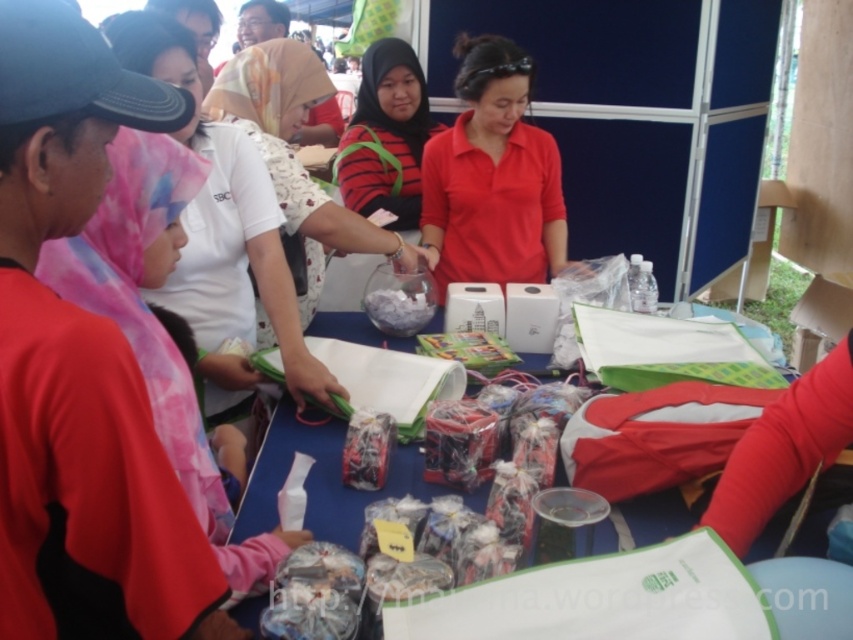
You are a participant at this event and you want to place a new item on the table. The item must be placed to the right of the pink fabric headscarf at left but not overlapping with the translucent glass bowl at center. Where should you place it?

Place the new item between the pink fabric headscarf at left and the translucent glass bowl at center, to the right of the pink fabric headscarf at left but not overlapping with the translucent glass bowl at center.

You are a participant at the event and want to grab the matte plastic candy at center without touching the matte red shirt at center. Is this possible?

The matte red shirt at center is larger in size than the matte plastic candy at center, so it might block access to the candy. You might need to move the shirt first.

You are standing at the center of the table and want to place a new item exactly at the same location as the pink fabric headscarf at left. What are the coordinates where you should place the new item?

The coordinates for the pink fabric headscarf at left are at point (223, 218), so you should place the new item at those coordinates.